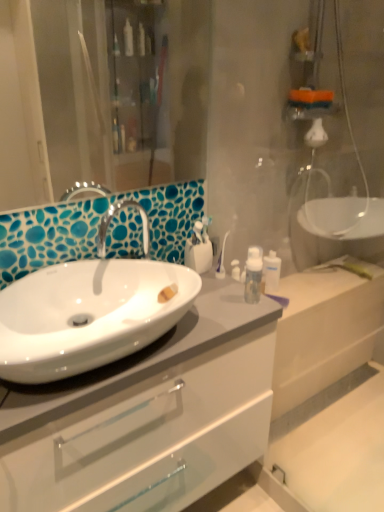
Question: From the image's perspective, is white glossy cabinet at center positioned above or below white glossy sink at center left?

Choices:
 (A) above
 (B) below

Answer: (B)

Question: Visually, is white glossy cabinet at center positioned to the left or to the right of white glossy sink at center left?

Choices:
 (A) right
 (B) left

Answer: (A)

Question: Based on their relative distances, which object is farther from the white glossy sink at center left?

Choices:
 (A) white glossy cabinet at center
 (B) white glossy toothbrush holder at center, the 1th toiletry when ordered from front to back
 (C) transparent plastic bottle at upper right, which is counted as the 1th toiletry, starting from the right

Answer: (C)

Question: Based on their relative distances, which object is farther from the transparent plastic bottle at upper right, the second toiletry viewed from the left?

Choices:
 (A) white glossy sink at center left
 (B) white glossy cabinet at center
 (C) white glossy toothbrush holder at center, the 1th toiletry in the left-to-right sequence

Answer: (A)